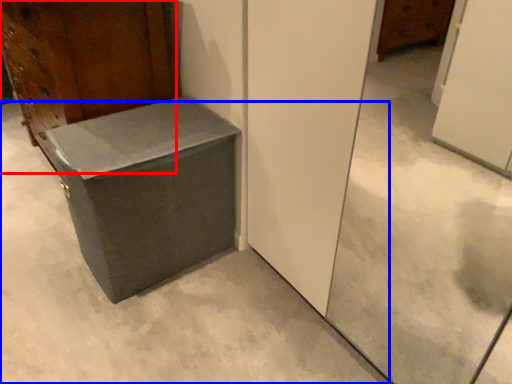
Question: Which object appears farthest to the camera in this image, furniture (highlighted by a red box) or concrete (highlighted by a blue box)?

Choices:
 (A) furniture
 (B) concrete

Answer: (A)